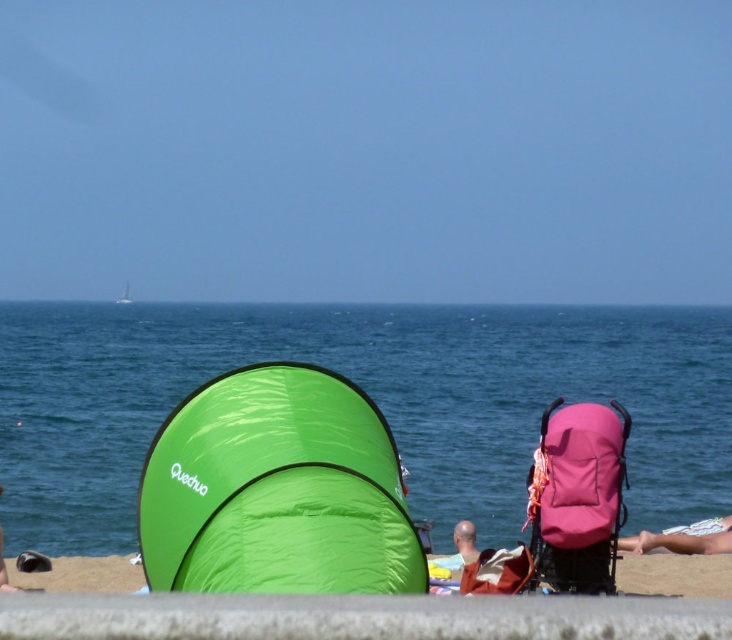
You are standing at the position of the pop up tent labeled Quechua. Which direction should you walk to reach the blue water at center?

Since the blue water at center is located at point (x=370, y=396), you should walk towards the center of the image to reach the blue water at center from the pop up tent labeled Quechua.

You are a photographer trying to capture a photo of the pink fabric stroller at right and the pink fabric towel at lower right. Which object should you focus on first if you want to include both in your frame without moving the camera?

The pink fabric stroller at right should be focused on first because it is shorter than the pink fabric towel at lower right, allowing the photographer to adjust the framing to include both objects.

You are a photographer trying to capture a photo of the pink fabric stroller at lower right without including the green fabric tent at lower center in the frame. Based on their positions, is this possible?

The green fabric tent at lower center is closer to the viewer than the pink fabric stroller at lower right, so the photographer can move to the side of the tent to capture the stroller without the tent blocking the view.